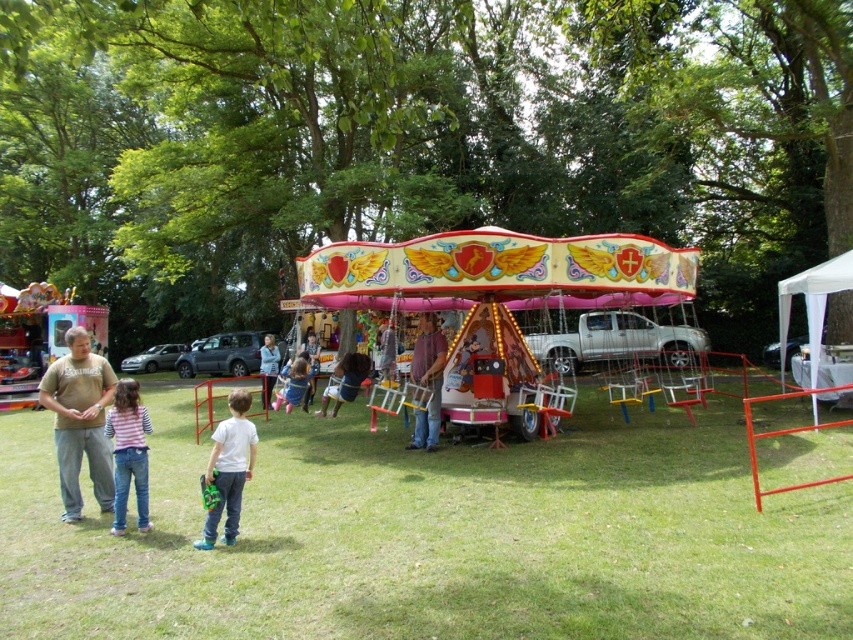
Is light blue denim jeans at center behind matte pink dress at center?

That is False.

Image resolution: width=853 pixels, height=640 pixels. Identify the location of light blue denim jeans at center. (345, 381).

This screenshot has height=640, width=853. Describe the element at coordinates (345, 381) in the screenshot. I see `light blue denim jeans at center` at that location.

Locate an element on the screen. The height and width of the screenshot is (640, 853). light blue denim jeans at center is located at coordinates (345, 381).

Does brown cotton shirt at left have a smaller size compared to matte pink swing at center?

Correct, brown cotton shirt at left occupies less space than matte pink swing at center.

Who is lower down, brown cotton shirt at left or matte pink swing at center?

matte pink swing at center is below.

Who is more forward, [90,467] or [288,381]?

Point [90,467] is in front.

The image size is (853, 640). In order to click on brown cotton shirt at left in this screenshot , I will do `click(79, 420)`.

Which of these two, shiny metallic carousel at center or matte pink swing at center, stands shorter?

With less height is shiny metallic carousel at center.

Can you confirm if shiny metallic carousel at center is positioned to the right of matte pink swing at center?

Correct, you'll find shiny metallic carousel at center to the right of matte pink swing at center.

Is point (456, 236) positioned before point (305, 360)?

Yes, it is in front of point (305, 360).

Image resolution: width=853 pixels, height=640 pixels. Find the location of `shiny metallic carousel at center`. shiny metallic carousel at center is located at coordinates (497, 266).